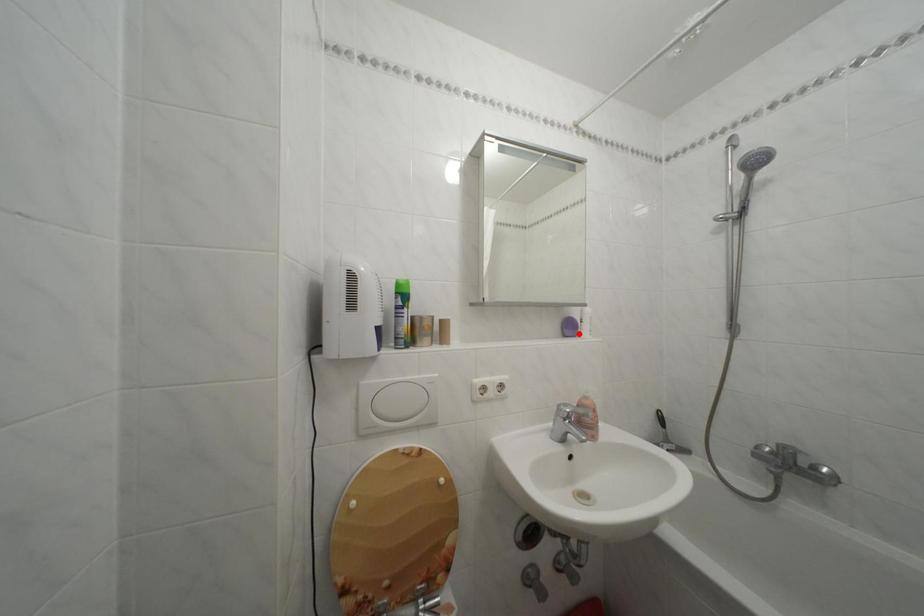
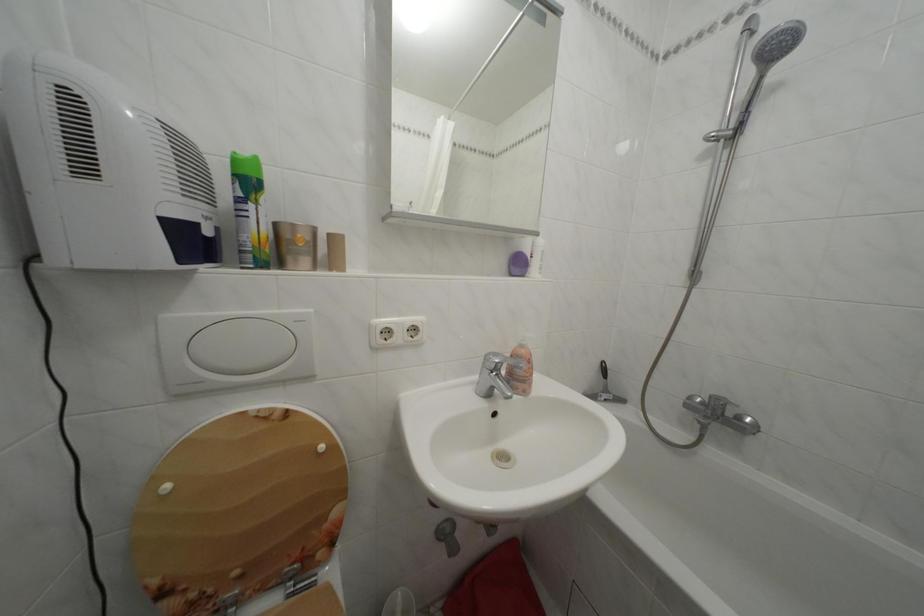
Find the pixel in the second image that matches the highlighted location in the first image.

(527, 270)